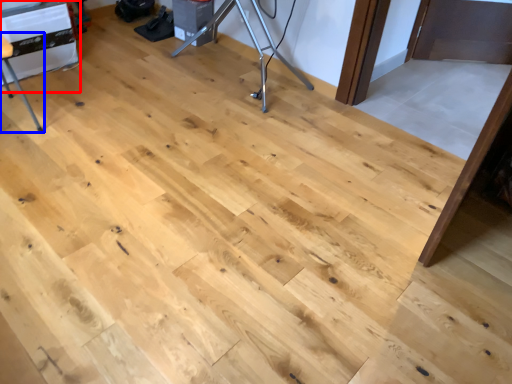
Question: Which point is further to the camera, table (highlighted by a red box) or furniture (highlighted by a blue box)?

Choices:
 (A) table
 (B) furniture

Answer: (A)